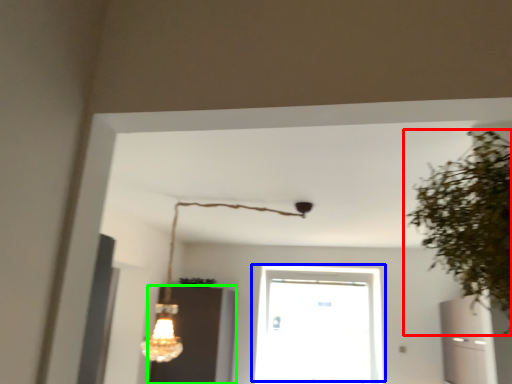
Question: Which object is positioned closest to houseplant (highlighted by a red box)? Select from window (highlighted by a blue box) and cabinetry (highlighted by a green box).

Choices:
 (A) window
 (B) cabinetry

Answer: (B)